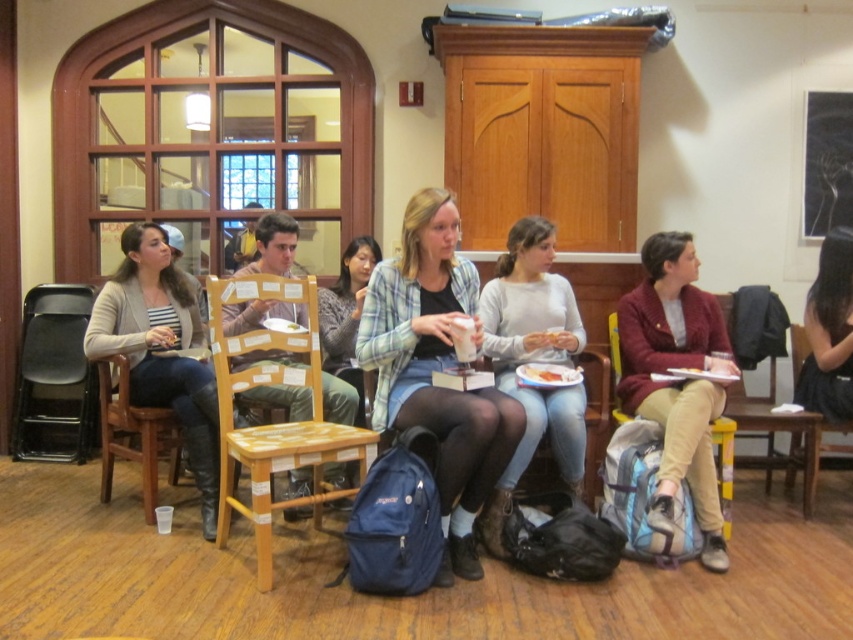
Who is more distant from viewer, (x=706, y=324) or (x=318, y=292)?

The point (x=318, y=292) is more distant.

Where is `maroon woolen sweater at right`? This screenshot has width=853, height=640. maroon woolen sweater at right is located at coordinates (677, 381).

I want to click on maroon woolen sweater at right, so click(x=677, y=381).

Which is more to the left, light gray sweater at center or black plastic chair at left?

black plastic chair at left is more to the left.

Does point (532, 392) come behind point (45, 451)?

No.

Between point (518, 257) and point (24, 298), which one is positioned behind?

The point (24, 298) is behind.

Image resolution: width=853 pixels, height=640 pixels. I want to click on light gray sweater at center, so click(535, 348).

Does point (796, 445) come farther from viewer compared to point (561, 374)?

Yes, it is.

Who is higher up, wooden chair at right or carrot salad at center?

Positioned higher is carrot salad at center.

The width and height of the screenshot is (853, 640). I want to click on wooden chair at right, so click(x=779, y=429).